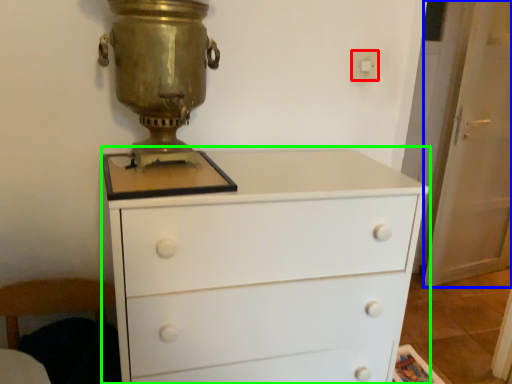
Question: Which object is the closest to the electric outlet (highlighted by a red box)? Choose among these: screen door (highlighted by a blue box) or chest of drawers (highlighted by a green box).

Choices:
 (A) screen door
 (B) chest of drawers

Answer: (B)